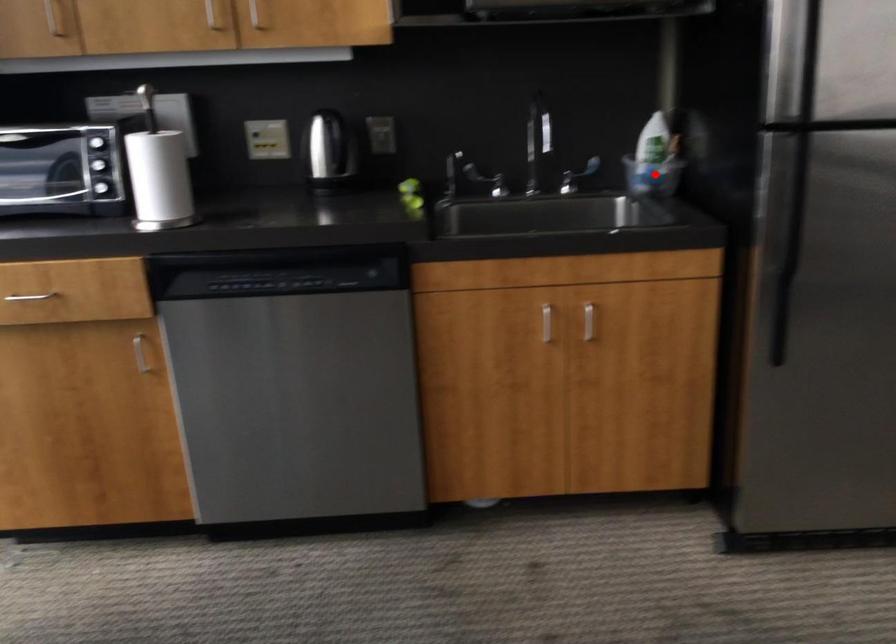
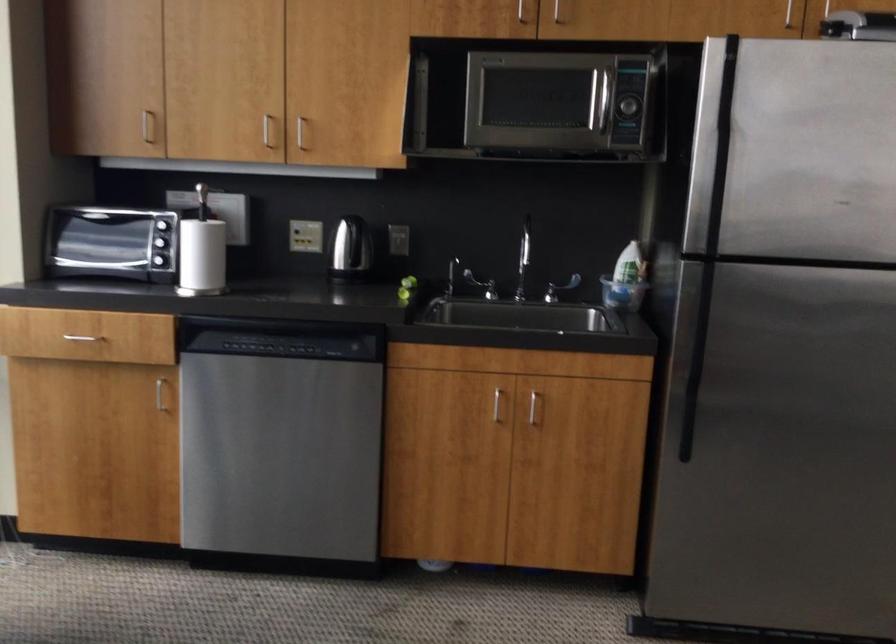
Locate, in the second image, the point that corresponds to the highlighted location in the first image.

(622, 294)